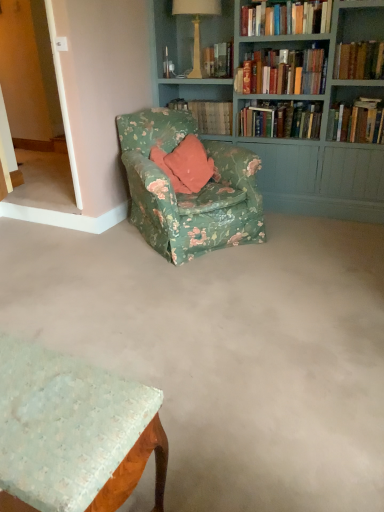
The height and width of the screenshot is (512, 384). What are the coordinates of `vacant area that lies to the right of floral fabric armchair at center` in the screenshot? It's located at (311, 242).